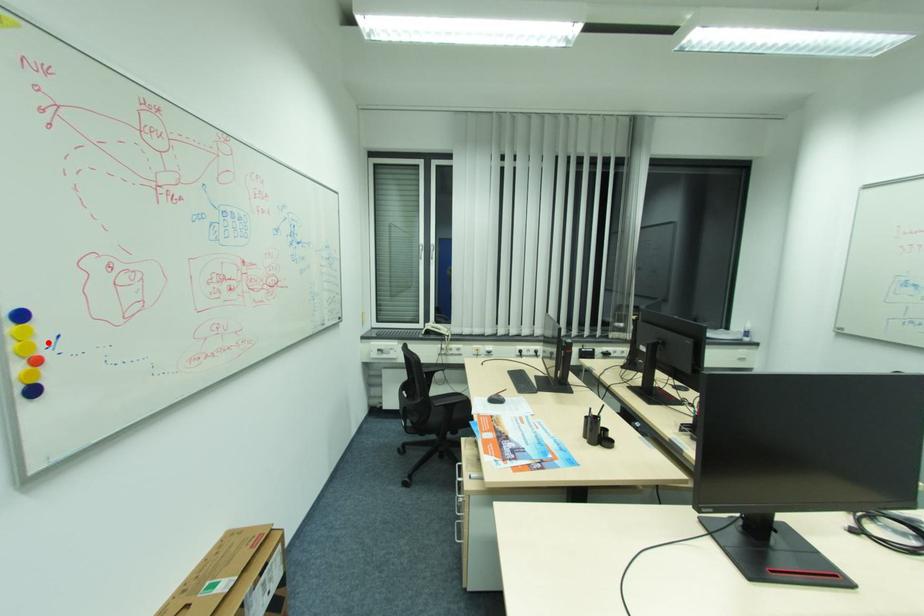
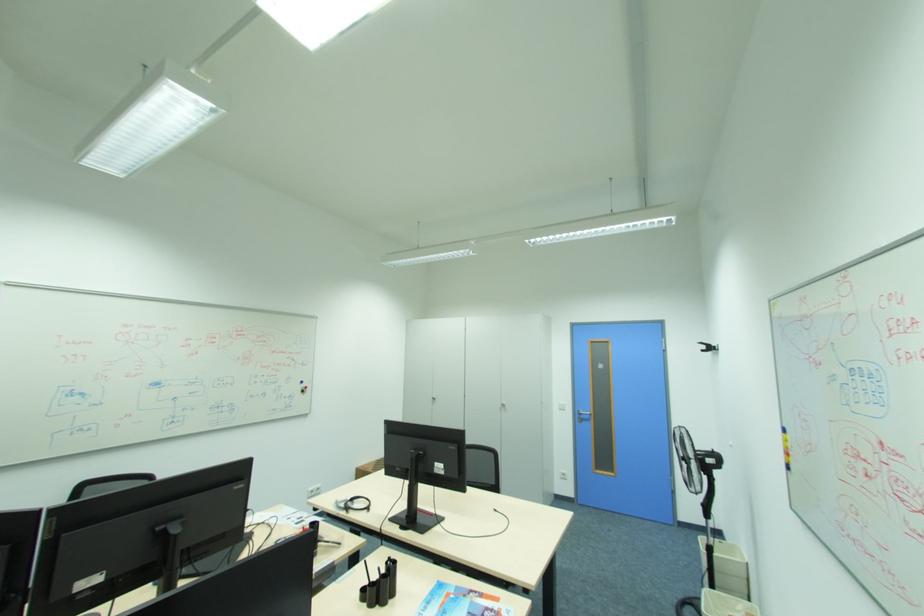
Where in the second image is the point corresponding to the highlighted location from the first image?

(794, 446)